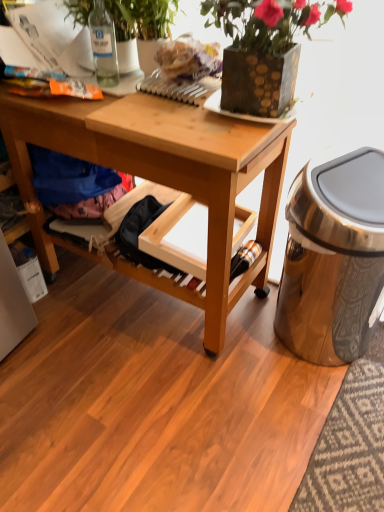
Question: Considering the relative positions of green leafy plant at upper center, positioned as the second houseplant in right-to-left order, and blue fabric at lower left in the image provided, is green leafy plant at upper center, positioned as the second houseplant in right-to-left order, to the right of blue fabric at lower left from the viewer's perspective?

Choices:
 (A) no
 (B) yes

Answer: (B)

Question: Does green leafy plant at upper center, the 1th houseplant positioned from the left, turn towards blue fabric at lower left?

Choices:
 (A) no
 (B) yes

Answer: (A)

Question: Can you confirm if green leafy plant at upper center, the 1th houseplant positioned from the left, is shorter than blue fabric at lower left?

Choices:
 (A) no
 (B) yes

Answer: (A)

Question: Considering the relative sizes of green leafy plant at upper center, positioned as the second houseplant in right-to-left order, and blue fabric at lower left in the image provided, is green leafy plant at upper center, positioned as the second houseplant in right-to-left order, wider than blue fabric at lower left?

Choices:
 (A) no
 (B) yes

Answer: (B)

Question: From the image's perspective, is green leafy plant at upper center, the 1th houseplant positioned from the left, located beneath blue fabric at lower left?

Choices:
 (A) yes
 (B) no

Answer: (B)

Question: Considering the relative sizes of green leafy plant at upper center, the 1th houseplant positioned from the left, and blue fabric at lower left in the image provided, is green leafy plant at upper center, the 1th houseplant positioned from the left, smaller than blue fabric at lower left?

Choices:
 (A) yes
 (B) no

Answer: (B)

Question: From the image's perspective, does matte plastic bag at upper center appear higher than green leafy plant at upper center, the 1th houseplant positioned from the left?

Choices:
 (A) yes
 (B) no

Answer: (B)

Question: Can you confirm if matte plastic bag at upper center is thinner than green leafy plant at upper center, positioned as the second houseplant in right-to-left order?

Choices:
 (A) no
 (B) yes

Answer: (B)

Question: From a real-world perspective, is matte plastic bag at upper center beneath green leafy plant at upper center, the 1th houseplant positioned from the left?

Choices:
 (A) yes
 (B) no

Answer: (A)

Question: Does matte plastic bag at upper center have a greater height compared to green leafy plant at upper center, the 1th houseplant positioned from the left?

Choices:
 (A) yes
 (B) no

Answer: (B)

Question: From a real-world perspective, is matte plastic bag at upper center physically above green leafy plant at upper center, positioned as the second houseplant in right-to-left order?

Choices:
 (A) no
 (B) yes

Answer: (A)

Question: Is matte plastic bag at upper center positioned before green leafy plant at upper center, the 1th houseplant positioned from the left?

Choices:
 (A) yes
 (B) no

Answer: (A)

Question: Is matte plastic bag at upper center shorter than textured brown vase at upper center, the first houseplant in the right-to-left sequence?

Choices:
 (A) no
 (B) yes

Answer: (B)